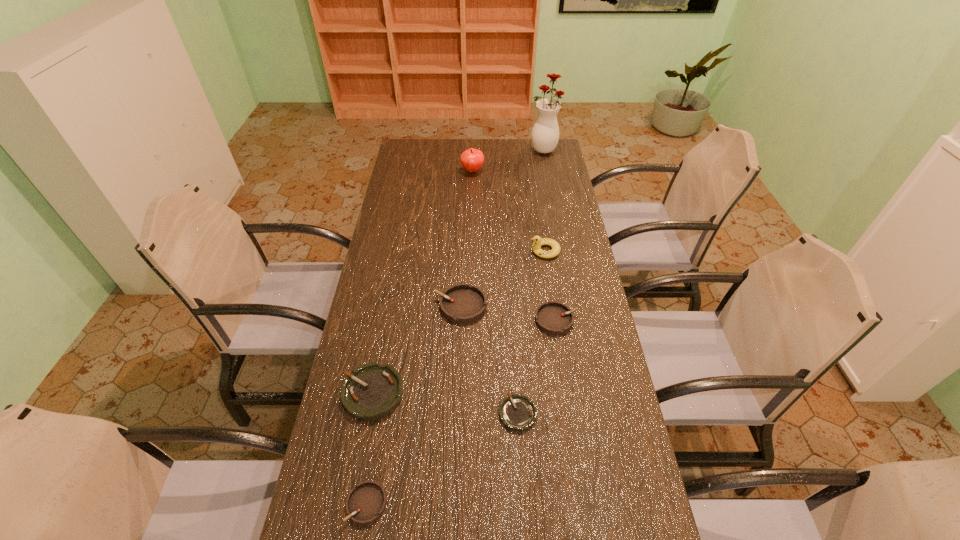
At what (x,y) coordinates should I click in order to perform the action: click on vacant space located 0.260m on the back of the fifth shortest object. Please return your answer as a coordinate pair (x, y). The width and height of the screenshot is (960, 540). Looking at the image, I should click on (463, 238).

At what (x,y) coordinates should I click in order to perform the action: click on free space located 0.350m on the back of the rightmost ashtray. Please return your answer as a coordinate pair (x, y). The image size is (960, 540). Looking at the image, I should click on (543, 235).

Where is `free space located 0.050m on the front of the left green ashtray`? free space located 0.050m on the front of the left green ashtray is located at coordinates (364, 440).

I want to click on vacant area situated on the right of the nearest ashtray, so click(x=434, y=503).

This screenshot has height=540, width=960. What are the coordinates of `vacant space located on the back of the fourth ashtray from left to right` in the screenshot? It's located at tap(511, 301).

What are the coordinates of `vase located at the far edge` in the screenshot? It's located at (545, 134).

You are a GUI agent. You are given a task and a screenshot of the screen. Output one action in this format:
    pyautogui.click(x=<x>, y=<y>)
    Task: Click on the apple located at the far edge
    
    Given the screenshot: What is the action you would take?
    pyautogui.click(x=472, y=159)

Find the location of a particular element. This screenshot has height=540, width=960. vase situated at the right edge is located at coordinates (545, 134).

Where is `duckling situated at the right edge`? This screenshot has height=540, width=960. duckling situated at the right edge is located at coordinates (538, 241).

Find the location of a particular element. The image size is (960, 540). ashtray present at the right edge is located at coordinates (555, 318).